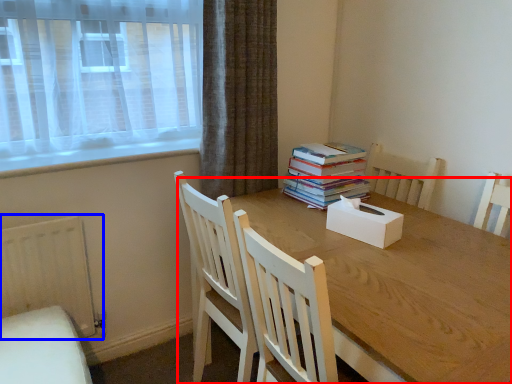
Question: Which object appears closest to the camera in this image, round table (highlighted by a red box) or radiator (highlighted by a blue box)?

Choices:
 (A) round table
 (B) radiator

Answer: (A)